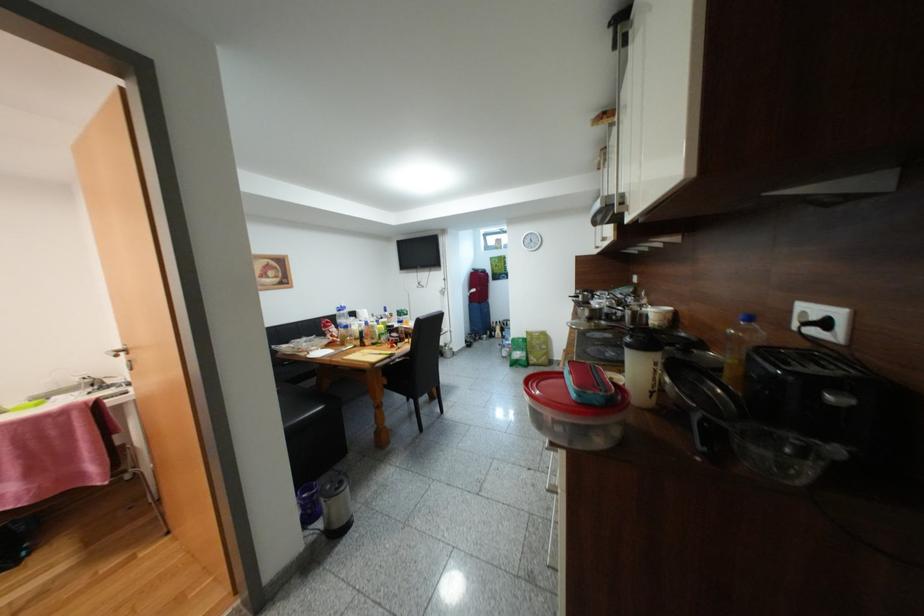
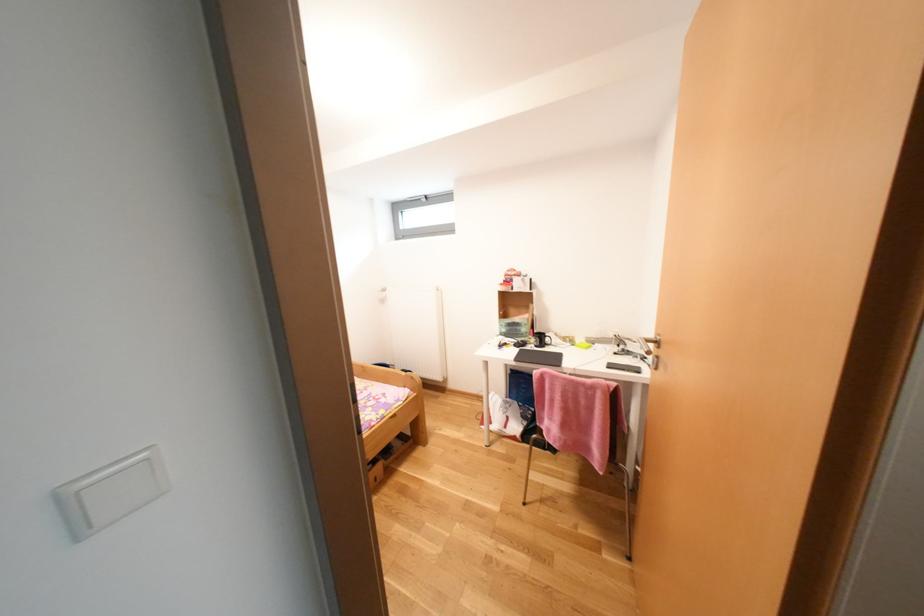
Question: The camera is either moving clockwise (left) or counter-clockwise (right) around the object. The first image is from the beginning of the video and the second image is from the end. Is the camera moving left or right when shooting the video?

Choices:
 (A) Left
 (B) Right

Answer: (B)